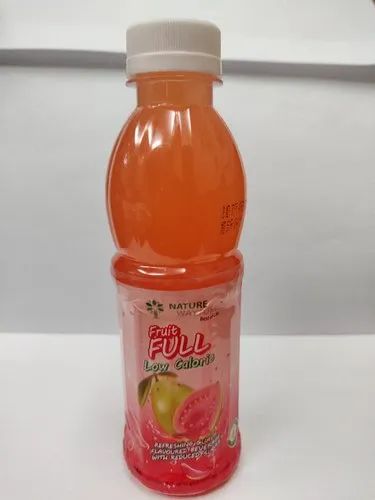
You are a GUI agent. You are given a task and a screenshot of the screen. Output one action in this format:
    pyautogui.click(x=<x>, y=<y>)
    Task: Click on the background white wall
    
    Given the screenshot: What is the action you would take?
    [268, 219]